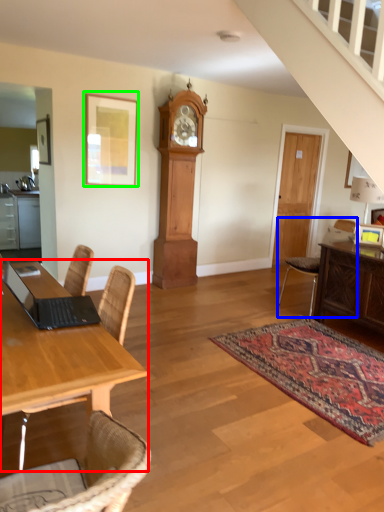
Question: Which object is positioned farthest from desk (highlighted by a red box)? Select from chair (highlighted by a blue box) and picture frame (highlighted by a green box).

Choices:
 (A) chair
 (B) picture frame

Answer: (A)